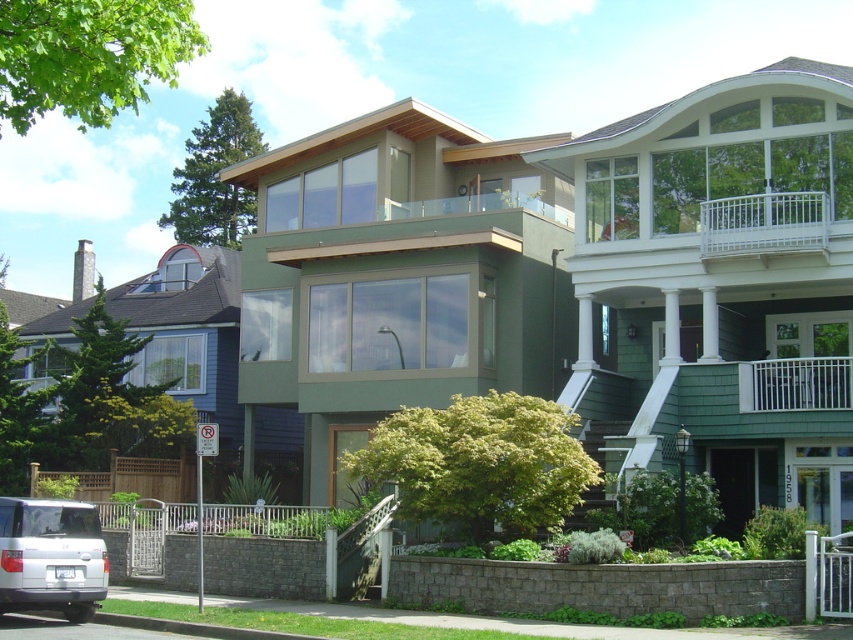
You are a delivery driver arriving at the residential area. You need to park your white matte suv at lower left near the curb without blocking the white wooden railing at upper right. Given their size difference, can your vehicle fit in the available space?

The white matte suv at lower left is bigger than the white wooden railing at upper right. However, since the railing is likely a structural element, you should ensure there is enough space between them to avoid obstruction. Check the parking area dimensions before proceeding.

You are standing at the point closest to the street in the residential area. You see two points marked as point (825, 205) and point (824, 384). Which point is farther away from you?

Point (825, 205) is farther away from you because it is behind point (824, 384).

You are a painter who needs to choose between two railings to paint. The white wooden railing at upper right and the white metal railing at upper right. Which one requires more paint because it has a larger surface area?

The white wooden railing at upper right requires more paint because it is larger in size than the white metal railing at upper right.